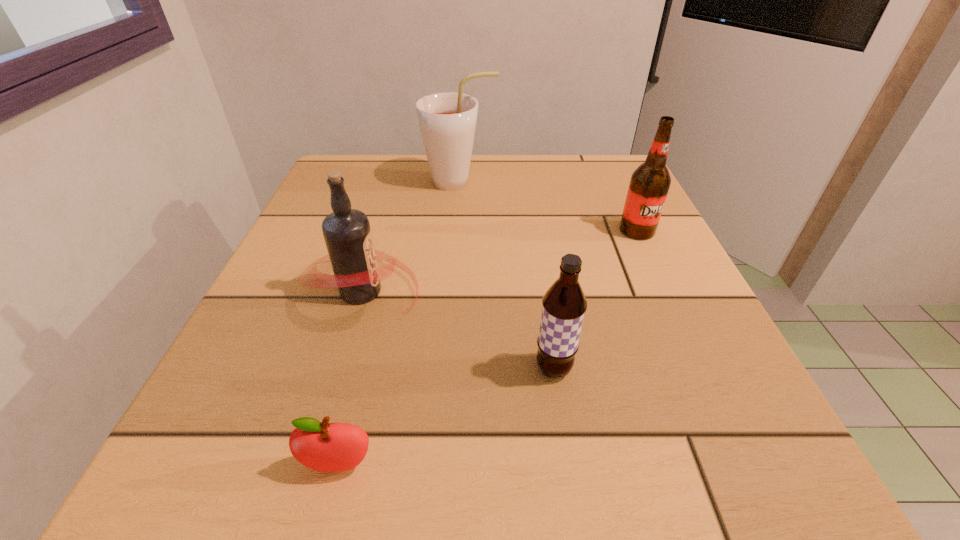
Choose which root beer is the nearest neighbor to the nearest object. Please provide its 2D coordinates. Your answer should be formatted as a tuple, i.e. [(x, y)], where the tuple contains the x and y coordinates of a point satisfying the conditions above.

[(347, 233)]

The width and height of the screenshot is (960, 540). Find the location of `free spot that satisfies the following two spatial constraints: 1. on the label of the third farthest root beer; 2. on the right side of the apple`. free spot that satisfies the following two spatial constraints: 1. on the label of the third farthest root beer; 2. on the right side of the apple is located at coordinates (311, 465).

This screenshot has height=540, width=960. What are the coordinates of `vacant space that satisfies the following two spatial constraints: 1. on the back side of the second nearest object; 2. on the label of the third nearest object` in the screenshot? It's located at (541, 291).

Where is `vacant space that satisfies the following two spatial constraints: 1. on the front side of the third nearest root beer; 2. on the label of the third nearest object`? The image size is (960, 540). vacant space that satisfies the following two spatial constraints: 1. on the front side of the third nearest root beer; 2. on the label of the third nearest object is located at coordinates (665, 291).

You are a GUI agent. You are given a task and a screenshot of the screen. Output one action in this format:
    pyautogui.click(x=<x>, y=<y>)
    Task: Click on the vacant area in the image that satisfies the following two spatial constraints: 1. on the drink side of the second nearest object; 2. on the right side of the farthest root beer
    
    Given the screenshot: What is the action you would take?
    pyautogui.click(x=446, y=369)

I want to click on vacant space that satisfies the following two spatial constraints: 1. on the drink side of the farthest root beer; 2. on the back side of the rightmost root beer, so click(456, 231).

What are the coordinates of `free space that satisfies the following two spatial constraints: 1. on the front side of the rightmost object; 2. on the label of the third farthest object` in the screenshot? It's located at (665, 291).